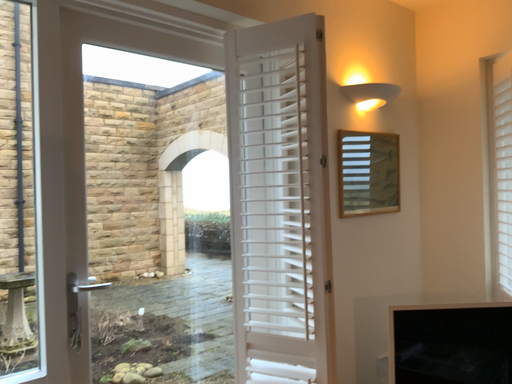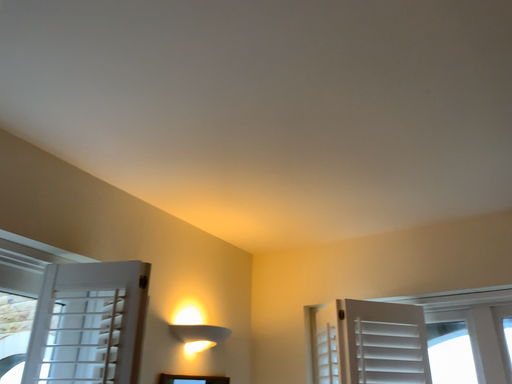
Question: Which way did the camera rotate in the video?

Choices:
 (A) rotated upward
 (B) rotated downward

Answer: (A)